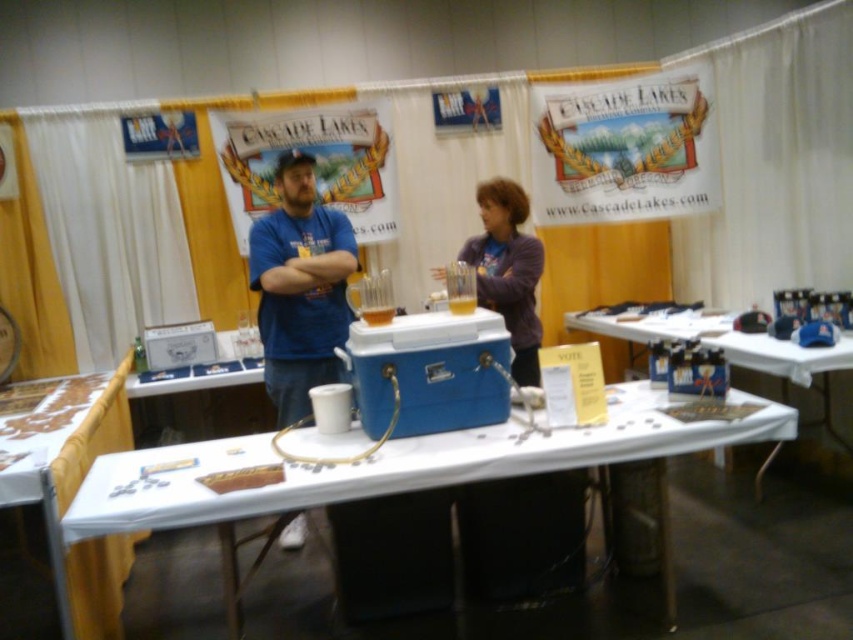
Question: Does blue plastic cooler at center have a larger size compared to white paper at lower left?

Choices:
 (A) no
 (B) yes

Answer: (A)

Question: Which object is closer to the camera taking this photo?

Choices:
 (A) blue t-shirt at center
 (B) matte blue cooler at center
 (C) white paper at lower left
 (D) purple fleece jacket at center

Answer: (C)

Question: Can you confirm if purple fleece jacket at center is wider than matte blue cooler at center?

Choices:
 (A) no
 (B) yes

Answer: (A)

Question: Which object is the farthest from the white paper at lower left?

Choices:
 (A) matte blue cooler at center
 (B) purple fleece jacket at center
 (C) blue plastic cooler at center

Answer: (A)

Question: Which object is farther from the camera taking this photo?

Choices:
 (A) blue plastic cooler at center
 (B) white paper at lower left
 (C) blue t-shirt at center

Answer: (C)

Question: Can you confirm if blue t-shirt at center is positioned below matte blue cooler at center?

Choices:
 (A) yes
 (B) no

Answer: (B)